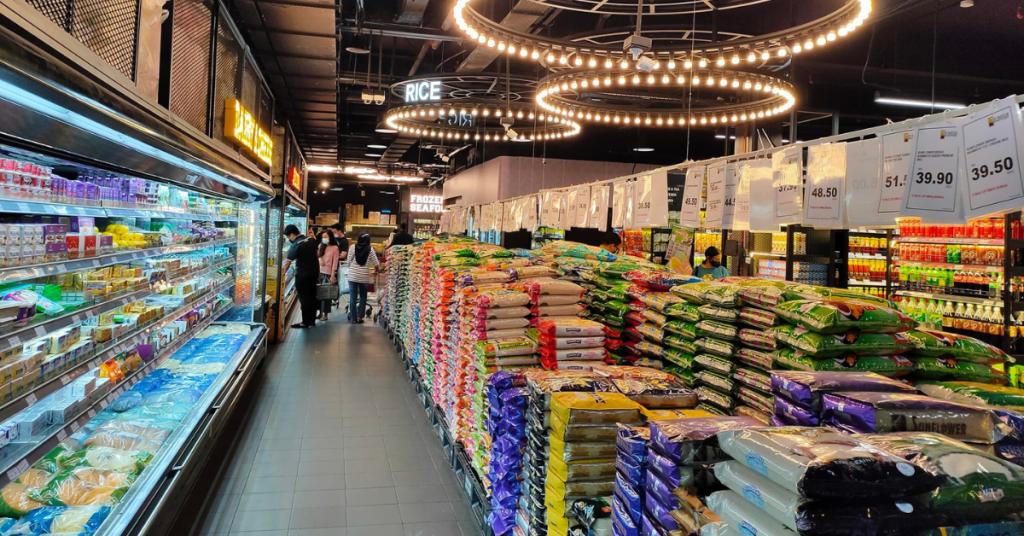
Locate an element on the screen. The height and width of the screenshot is (536, 1024). fridge is located at coordinates (154, 414).